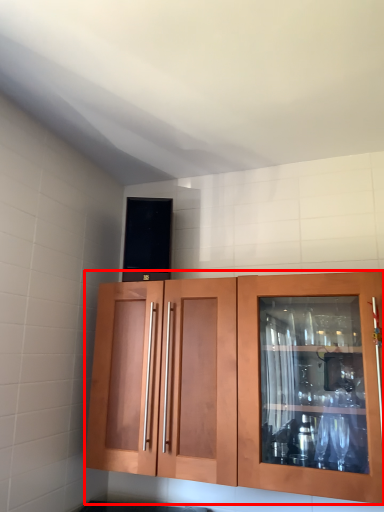
Question: From the image's perspective, where is cabinetry (annotated by the red box) located in relation to appliance in the image?

Choices:
 (A) above
 (B) below

Answer: (B)